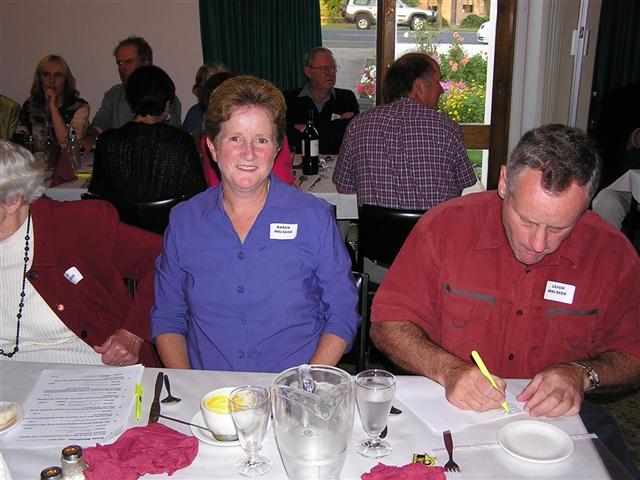
Find the location of a particular element. window is located at coordinates (456, 35).